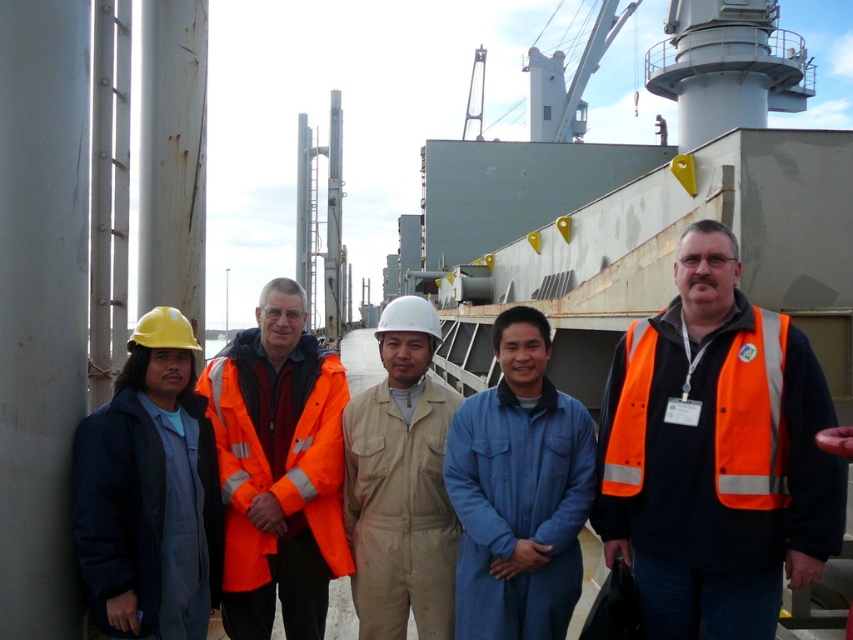
You are a safety inspector evaluating the visibility of workers in an industrial area. You notice two workers wearing different protective gear. The first worker is wearing matte blue coveralls at left, and the second is wearing orange reflective safety vest at right. Which worker might have better visibility in low light conditions?

The orange reflective safety vest at right provides better visibility in low light conditions because it is designed with reflective elements, whereas the matte blue coveralls at left, though larger in size, do not have the same reflective properties mentioned in the description.

You are a safety inspector standing between the matte blue coveralls at left and the blue cotton coverall at center. According to safety regulations, workers must maintain a minimum distance of 3 meters between each other to avoid accidents. Are the workers currently violating this rule?

The matte blue coveralls at left and blue cotton coverall at center are 2.64 meters apart, which is less than the required 3 meters. Therefore, the workers are violating the safety regulation.